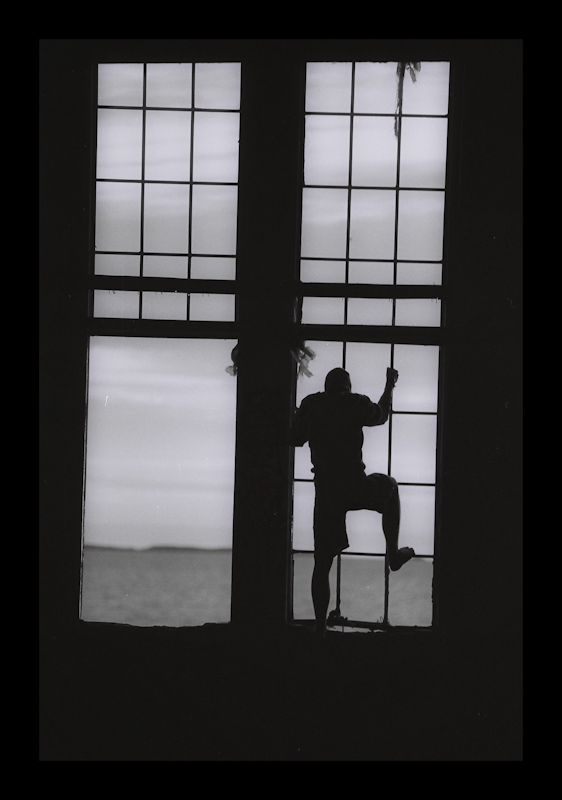
Identify the location of lower right window. (371, 580).